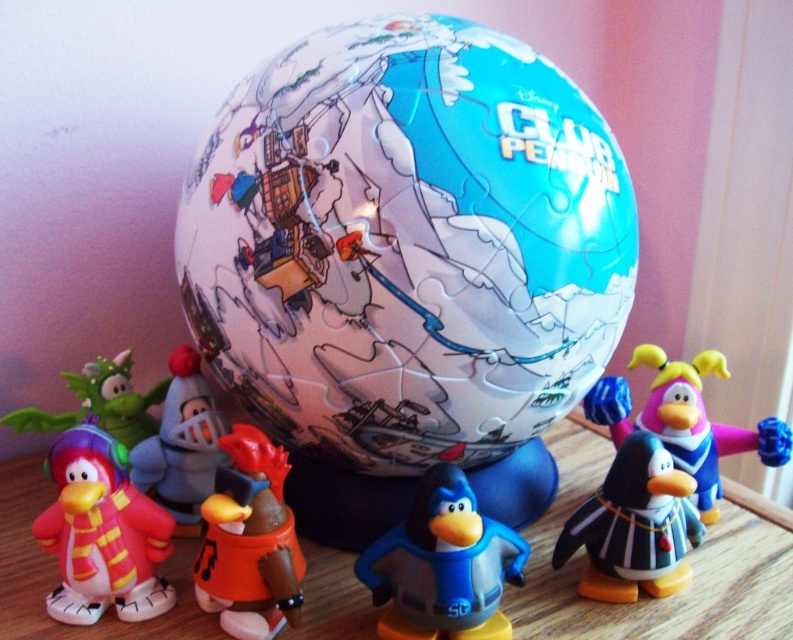
You are organizing a display for a toy store and need to place the blue plastic penguin at center and orange matte bucket at center on a shelf. If the shelf has limited space, which object should you place first to ensure both fit properly?

The blue plastic penguin at center is wider than the orange matte bucket at center. To ensure both fit on the shelf with limited space, place the wider blue plastic penguin at center first, then the narrower orange matte bucket at center.

You are a collector trying to place the shiny blue plastic penguin at center right and the matte plastic knight at center into a display case. The case has a width limit of 15 cm. If the knight is exactly 12 cm wide, can both fit side by side?

The shiny blue plastic penguin at center right is wider than the matte plastic knight at center. Since the knight is 12 cm wide, the penguin must be wider than 12 cm. Adding both widths would exceed the 15 cm limit, so they cannot fit side by side.

You are organizing a display for a toy store and need to place the blue plastic penguin at center and orange matte bucket at center on a shelf. If the shelf has limited space, which object should you prioritize placing first to ensure both fit?

The blue plastic penguin at center is larger than the orange matte bucket at center, so you should place the blue plastic penguin at center first to ensure there is enough space for both.